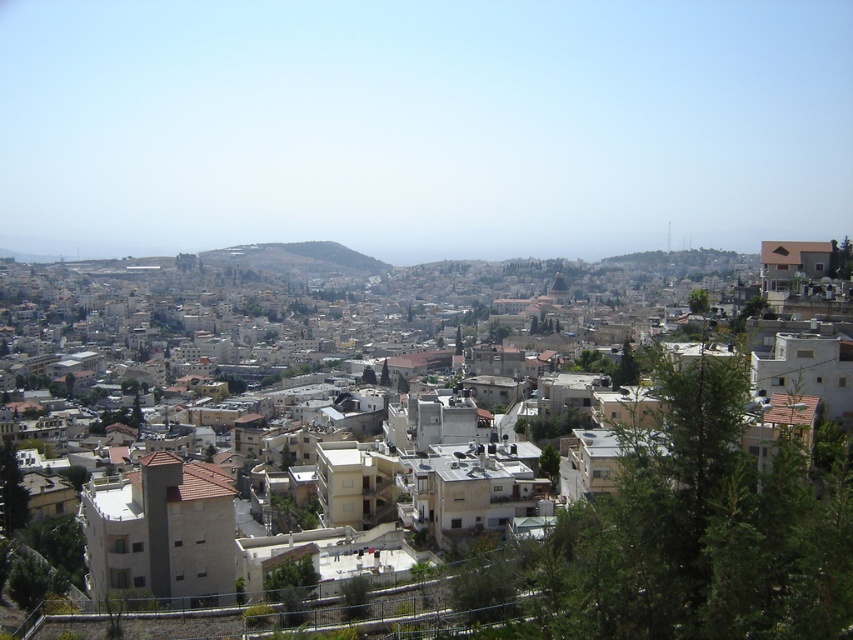
Question: Does beige stone buildings at center appear under green grassy hillside at center?

Choices:
 (A) yes
 (B) no

Answer: (A)

Question: Which point appears farthest from the camera in this image?

Choices:
 (A) (302, 253)
 (B) (56, 282)

Answer: (B)

Question: Is beige stone buildings at center to the left of green grassy hillside at center from the viewer's perspective?

Choices:
 (A) no
 (B) yes

Answer: (A)

Question: Does beige stone buildings at center have a lesser width compared to green grassy hillside at center?

Choices:
 (A) no
 (B) yes

Answer: (A)

Question: Which point appears farthest from the camera in this image?

Choices:
 (A) (346, 260)
 (B) (281, 323)

Answer: (A)

Question: Which object is closer to the camera taking this photo?

Choices:
 (A) beige stone buildings at center
 (B) green grassy hillside at center

Answer: (A)